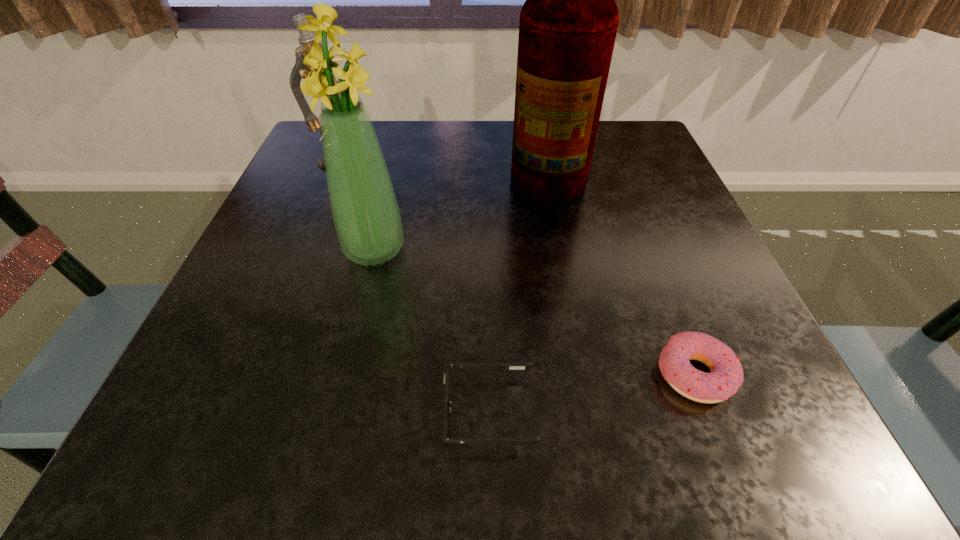
Where is `vacant space that satisfies the following two spatial constraints: 1. at the nozzle of the fire extinguisher; 2. on the right side of the fourth tallest object`? The image size is (960, 540). vacant space that satisfies the following two spatial constraints: 1. at the nozzle of the fire extinguisher; 2. on the right side of the fourth tallest object is located at coordinates (583, 375).

Where is `free location that satisfies the following two spatial constraints: 1. on the front-facing side of the second shortest object; 2. on the right side of the fourth shortest object`? The image size is (960, 540). free location that satisfies the following two spatial constraints: 1. on the front-facing side of the second shortest object; 2. on the right side of the fourth shortest object is located at coordinates (345, 375).

The image size is (960, 540). I want to click on free location that satisfies the following two spatial constraints: 1. at the nozzle of the fire extinguisher; 2. on the right side of the rightmost object, so click(583, 375).

At what (x,y) coordinates should I click in order to perform the action: click on free space that satisfies the following two spatial constraints: 1. at the nozzle of the tallest object; 2. on the right side of the doughnut. Please return your answer as a coordinate pair (x, y). This screenshot has width=960, height=540. Looking at the image, I should click on (583, 375).

The width and height of the screenshot is (960, 540). In order to click on vacant space that satisfies the following two spatial constraints: 1. at the nozzle of the tallest object; 2. on the front-facing side of the third farthest object in this screenshot , I will do `click(560, 251)`.

The height and width of the screenshot is (540, 960). Identify the location of free spot that satisfies the following two spatial constraints: 1. at the nozzle of the fire extinguisher; 2. on the front-facing side of the bouquet. (560, 251).